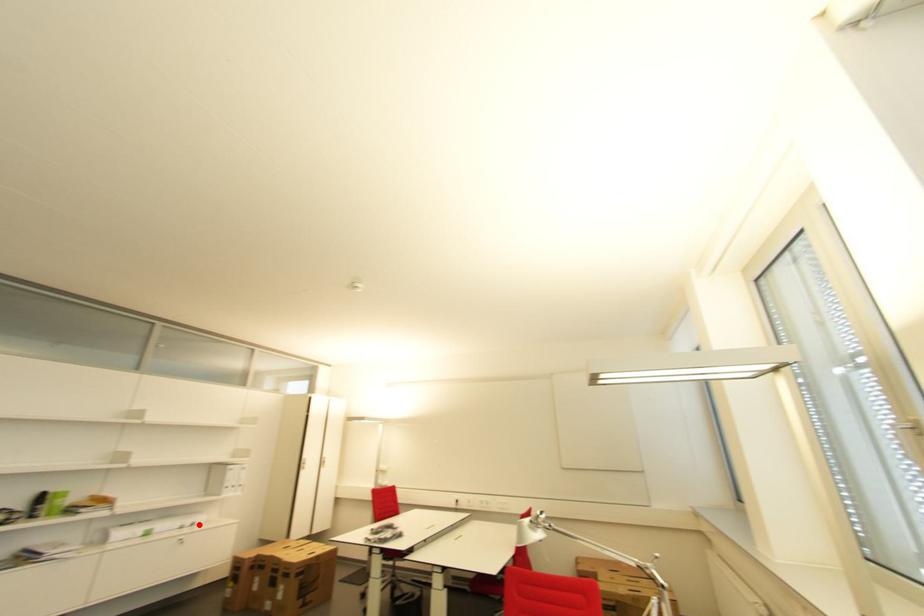
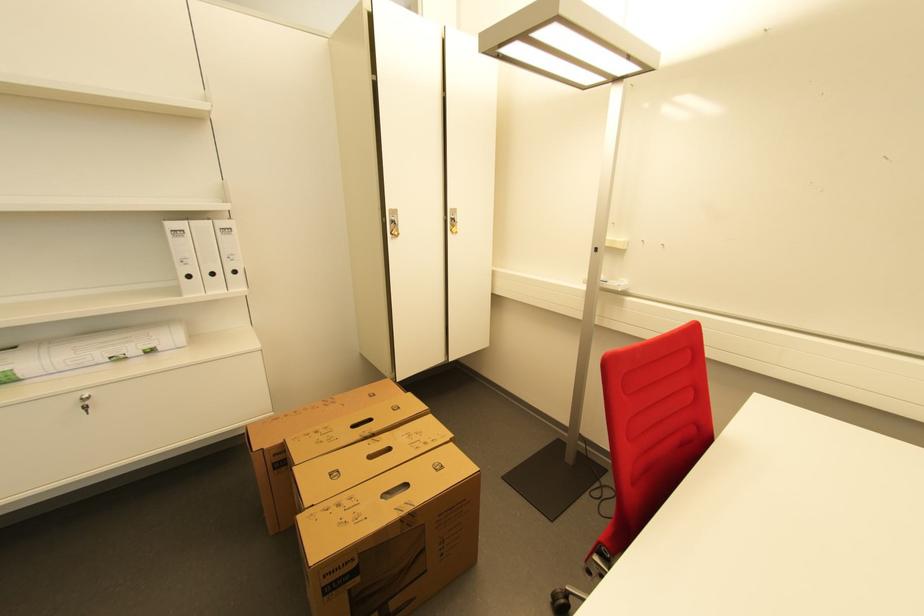
Question: I am providing you with two images of the same scene from different viewpoints. A red point is shown in image1. For the corresponding object point in image2, is it positioned nearer or farther from the camera?

Choices:
 (A) Nearer
 (B) Farther

Answer: (B)